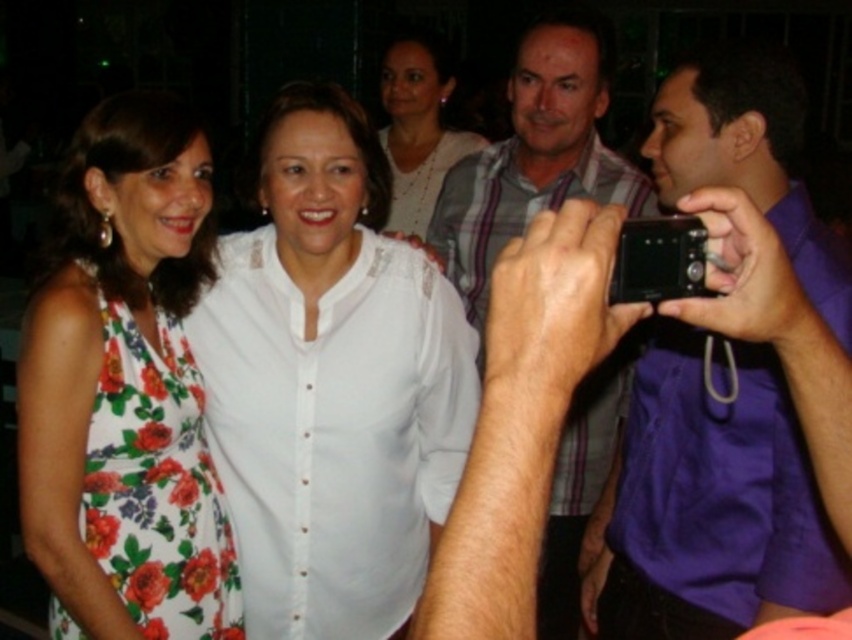
In the scene shown: You are standing at the point marked by the coordinates point (332, 429) in the image. What object is directly in front of you?

The point (332, 429) indicates white sheer shirt at center, so the object directly in front of you is the white sheer shirt at center.

You are a photographer at the event and want to ensure the subject in the white sheer shirt at center is in focus. The camera has a depth of field that can sharply focus on objects within 1.5 meters. Is the subject within the camera focus range?

The white sheer shirt at center is 1.58 meters away from camera. Since the camera can focus within 1.5 meters, the subject is slightly beyond the focus range and may appear slightly out of focus.

You are at the center of the image and want to move towards the white sheer shirt at center. Which direction should you move?

The white sheer shirt at center is already at the center of the image, so you don not need to move in any direction to reach it.